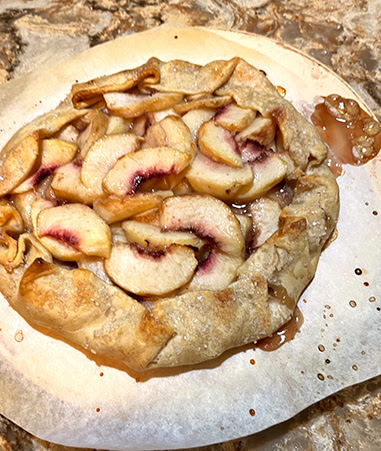
Where is `counter top`? The height and width of the screenshot is (451, 381). counter top is located at coordinates tap(309, 36), tap(349, 426), tap(14, 442), tap(36, 38).